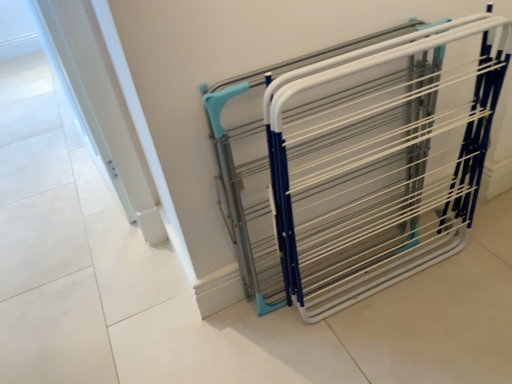
Where is `white metal gate at center`? white metal gate at center is located at coordinates (360, 161).

The image size is (512, 384). What do you see at coordinates (360, 161) in the screenshot?
I see `white metal gate at center` at bounding box center [360, 161].

At what (x,y) coordinates should I click in order to perform the action: click on white metal gate at center. Please return your answer as a coordinate pair (x, y). The width and height of the screenshot is (512, 384). Looking at the image, I should click on (360, 161).